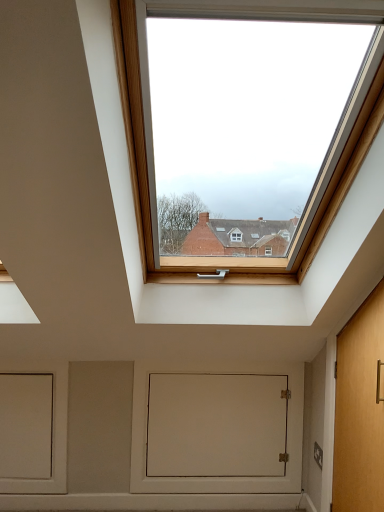
Question: Is light brown wooden door at right looking in the opposite direction of white matte door at center?

Choices:
 (A) no
 (B) yes

Answer: (A)

Question: From the image's perspective, is light brown wooden door at right below white matte door at center?

Choices:
 (A) yes
 (B) no

Answer: (B)

Question: From a real-world perspective, is light brown wooden door at right under white matte door at center?

Choices:
 (A) no
 (B) yes

Answer: (A)

Question: Is light brown wooden door at right touching white matte door at center?

Choices:
 (A) yes
 (B) no

Answer: (B)

Question: Is light brown wooden door at right facing towards white matte door at center?

Choices:
 (A) no
 (B) yes

Answer: (A)

Question: Is light brown wooden door at right bigger than white matte door at center?

Choices:
 (A) yes
 (B) no

Answer: (A)

Question: From the image's perspective, is white matte door at center located beneath light brown wooden door at right?

Choices:
 (A) no
 (B) yes

Answer: (B)

Question: From a real-world perspective, is white matte door at center physically below light brown wooden door at right?

Choices:
 (A) no
 (B) yes

Answer: (B)

Question: Is white matte door at center not close to light brown wooden door at right?

Choices:
 (A) no
 (B) yes

Answer: (A)

Question: Is white matte door at center completely or partially outside of light brown wooden door at right?

Choices:
 (A) no
 (B) yes

Answer: (B)

Question: Considering the relative sizes of white matte door at center and light brown wooden door at right in the image provided, is white matte door at center shorter than light brown wooden door at right?

Choices:
 (A) yes
 (B) no

Answer: (A)

Question: Does white matte door at center have a greater width compared to light brown wooden door at right?

Choices:
 (A) no
 (B) yes

Answer: (A)

Question: Considering the positions of light brown wooden door at right and white matte door at center in the image, is light brown wooden door at right wider or thinner than white matte door at center?

Choices:
 (A) thin
 (B) wide

Answer: (B)